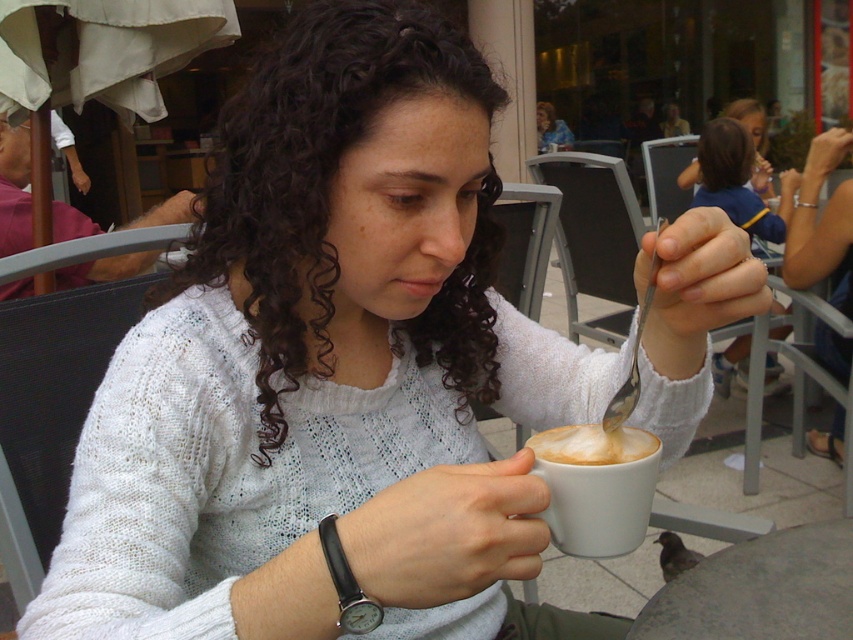
You are a barista standing behind the counter and see the customer holding a cup with the foamy white coffee at cup center. The customer complains that their coffee is too hot to drink. You have a spoon that is 6 inches long. Can you safely stir the coffee without burning your hand?

The foamy white coffee at cup center is 18.26 inches away from the viewer. Since the spoon is only 6 inches long, the barista cannot reach the coffee to stir it safely. They need a longer utensil.